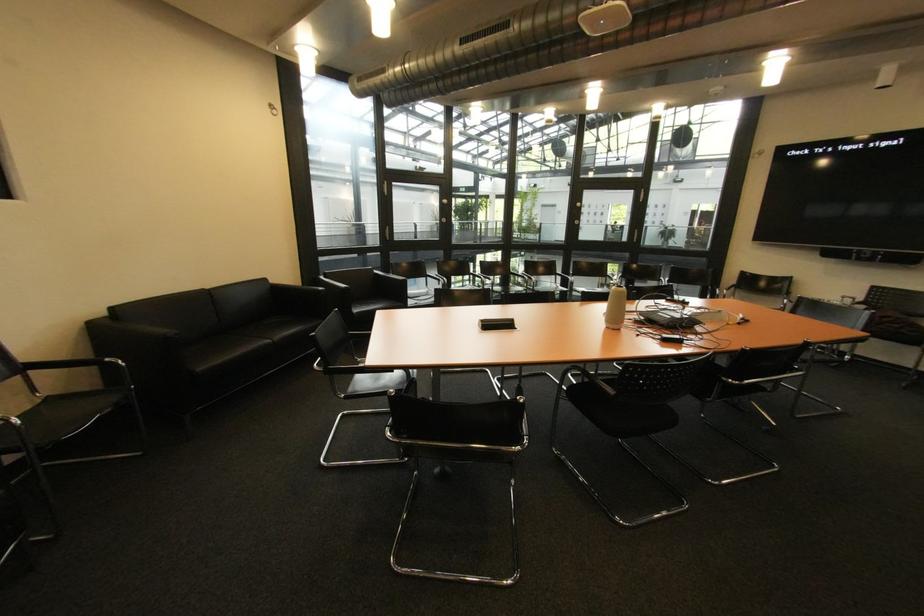
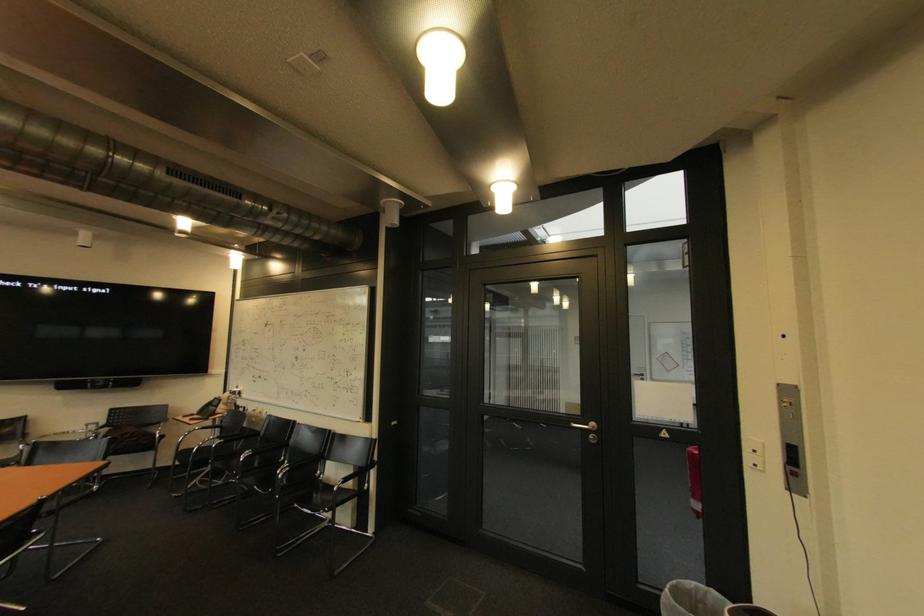
Question: The first image is from the beginning of the video and the second image is from the end. How did the camera likely rotate when shooting the video?

Choices:
 (A) Left
 (B) Right
 (C) Up
 (D) Down

Answer: (B)